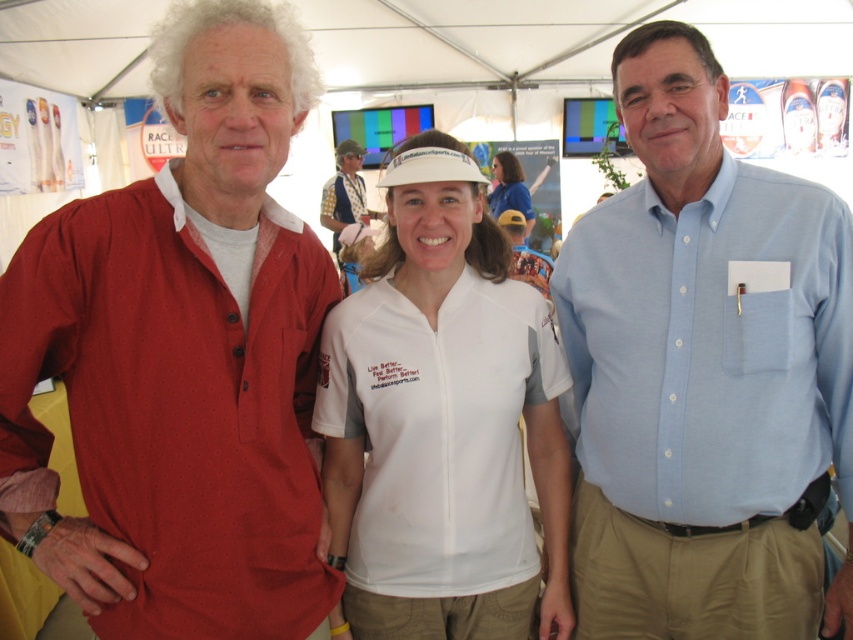
Question: Which point appears closest to the camera in this image?

Choices:
 (A) (755, 627)
 (B) (265, 550)
 (C) (349, 177)

Answer: (B)

Question: Can you confirm if white fabric visor at center is smaller than checkered fabric shirt at center?

Choices:
 (A) no
 (B) yes

Answer: (B)

Question: Which point is farther from the camera taking this photo?

Choices:
 (A) (494, 212)
 (B) (354, 156)
 (C) (793, 250)

Answer: (B)

Question: Considering the relative positions of matte red shirt at center and white fabric visor at center in the image provided, where is matte red shirt at center located with respect to white fabric visor at center?

Choices:
 (A) right
 (B) left

Answer: (B)

Question: Considering the relative positions of matte red shirt at center and white matte visor at center in the image provided, where is matte red shirt at center located with respect to white matte visor at center?

Choices:
 (A) above
 (B) below

Answer: (B)

Question: Among these points, which one is nearest to the camera?

Choices:
 (A) (523, 186)
 (B) (277, 586)
 (C) (459, 566)
 (D) (331, 180)

Answer: (B)